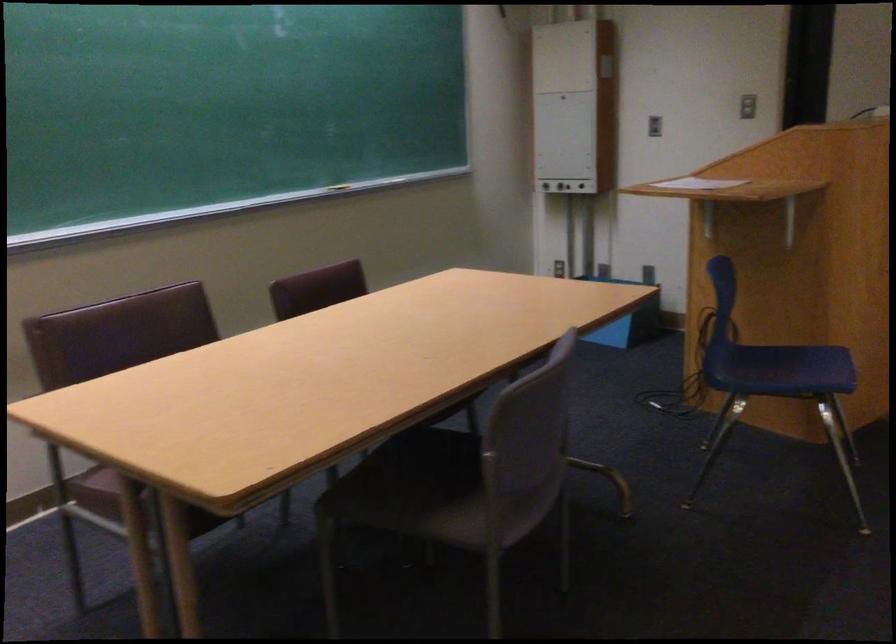
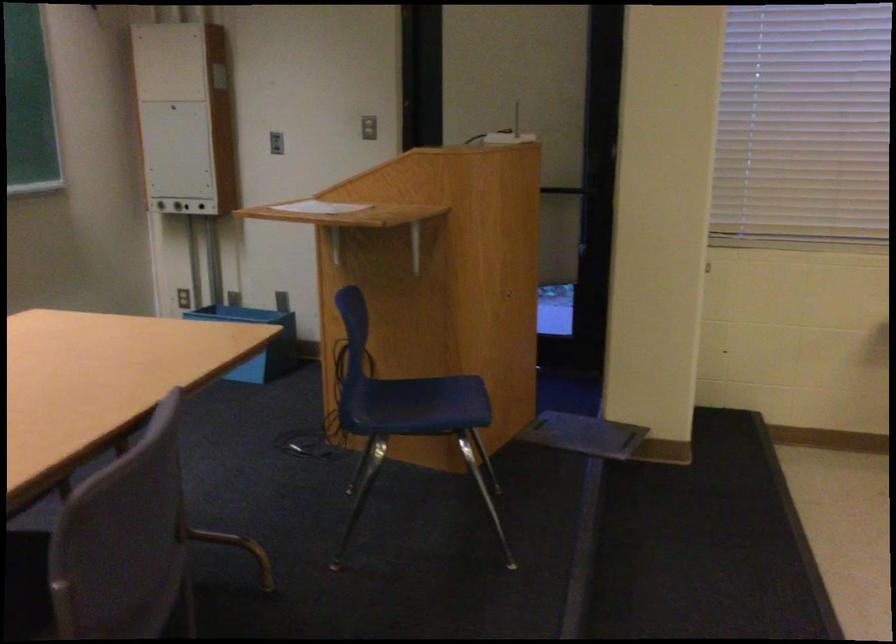
Question: Based on the continuous images, in which direction is the camera rotating? Reply with the corresponding letter.

Choices:
 (A) Left
 (B) Right
 (C) Up
 (D) Down

Answer: (B)